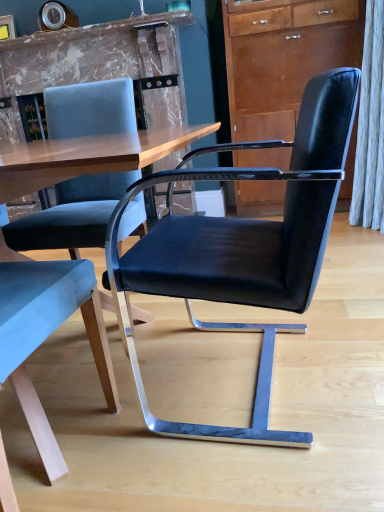
Question: From a real-world perspective, is matte brown cabinet at upper right located higher than velvet blue chair at left, which appears as the 2th chair when viewed from the right?

Choices:
 (A) yes
 (B) no

Answer: (A)

Question: Does matte brown cabinet at upper right have a lesser width compared to velvet blue chair at left, the first chair from the left?

Choices:
 (A) no
 (B) yes

Answer: (B)

Question: Is matte brown cabinet at upper right to the right of velvet blue chair at left, which appears as the 2th chair when viewed from the right, from the viewer's perspective?

Choices:
 (A) yes
 (B) no

Answer: (A)

Question: Is the depth of matte brown cabinet at upper right greater than that of velvet blue chair at left, which appears as the 2th chair when viewed from the right?

Choices:
 (A) yes
 (B) no

Answer: (A)

Question: From the image's perspective, is matte brown cabinet at upper right on top of velvet blue chair at left, the first chair from the left?

Choices:
 (A) no
 (B) yes

Answer: (B)

Question: Would you say velvet blue chair at left, which appears as the 2th chair when viewed from the right, is to the left or to the right of matte brown cabinet at upper right in the picture?

Choices:
 (A) right
 (B) left

Answer: (B)

Question: Is velvet blue chair at left, the first chair from the left, spatially inside matte brown cabinet at upper right, or outside of it?

Choices:
 (A) outside
 (B) inside

Answer: (A)

Question: Is velvet blue chair at left, the first chair from the left, in front of or behind matte brown cabinet at upper right in the image?

Choices:
 (A) front
 (B) behind

Answer: (A)

Question: Is velvet blue chair at left, which appears as the 2th chair when viewed from the right, bigger or smaller than matte brown cabinet at upper right?

Choices:
 (A) big
 (B) small

Answer: (B)

Question: Would you say matte brown cabinet at upper right is inside or outside velvet blue chair at left, which appears as the 2th chair when viewed from the right?

Choices:
 (A) inside
 (B) outside

Answer: (B)

Question: Looking at their shapes, would you say matte brown cabinet at upper right is wider or thinner than velvet blue chair at left, the first chair from the left?

Choices:
 (A) wide
 (B) thin

Answer: (B)

Question: Is point (271, 182) positioned closer to the camera than point (24, 279)?

Choices:
 (A) farther
 (B) closer

Answer: (A)

Question: From their relative heights in the image, would you say matte brown cabinet at upper right is taller or shorter than velvet blue chair at left, the first chair from the left?

Choices:
 (A) tall
 (B) short

Answer: (A)

Question: Considering the positions of matte brown cabinet at upper right and black leather chair at center, marked as the 1th chair in a right-to-left arrangement, in the image, is matte brown cabinet at upper right bigger or smaller than black leather chair at center, marked as the 1th chair in a right-to-left arrangement,?

Choices:
 (A) small
 (B) big

Answer: (B)

Question: Is matte brown cabinet at upper right wider or thinner than black leather chair at center, marked as the 1th chair in a right-to-left arrangement?

Choices:
 (A) wide
 (B) thin

Answer: (B)